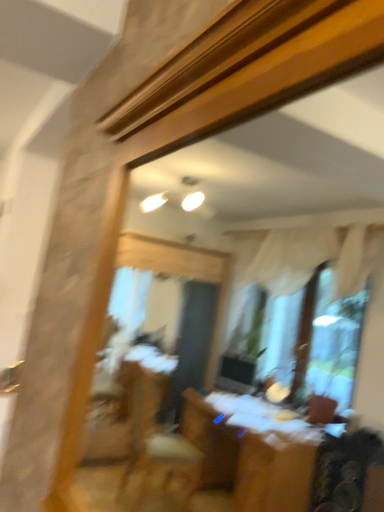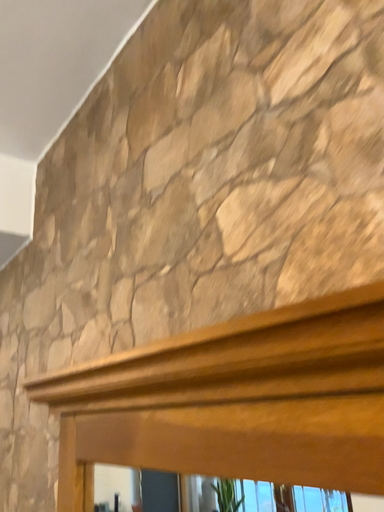
Question: How did the camera likely rotate when shooting the video?

Choices:
 (A) rotated left
 (B) rotated right

Answer: (B)